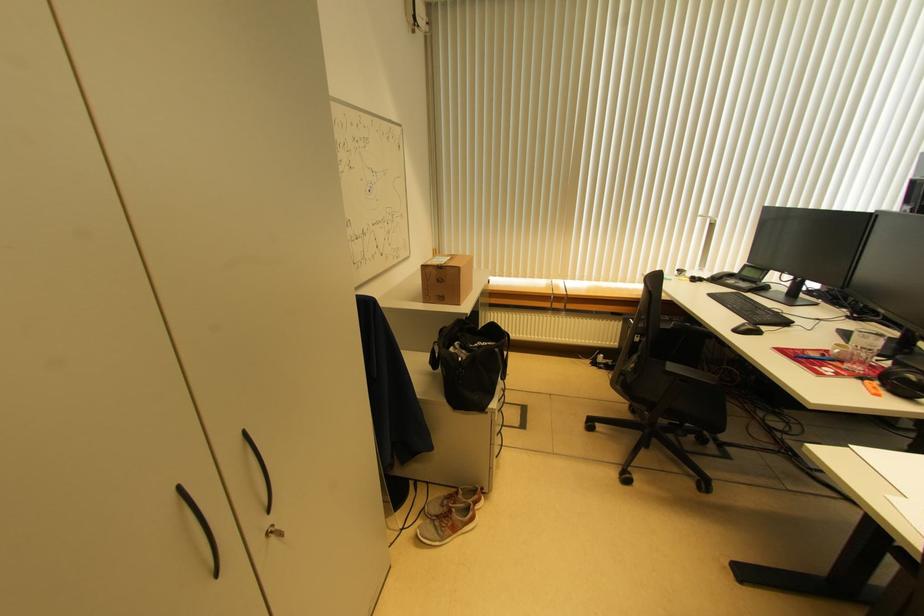
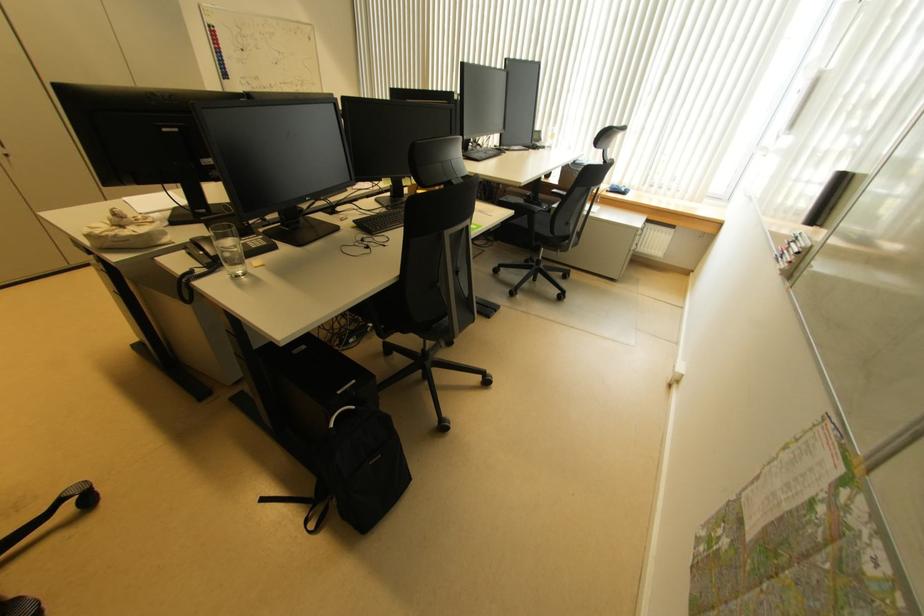
Which direction would the cameraman need to move to produce the second image?

The cameraman walked toward right, backward.